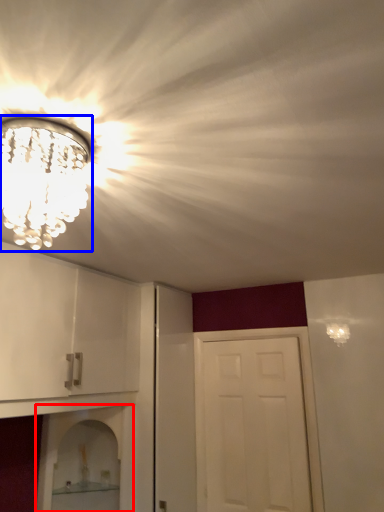
Question: Among these objects, which one is farthest to the camera, shelf (highlighted by a red box) or light fixture (highlighted by a blue box)?

Choices:
 (A) shelf
 (B) light fixture

Answer: (A)